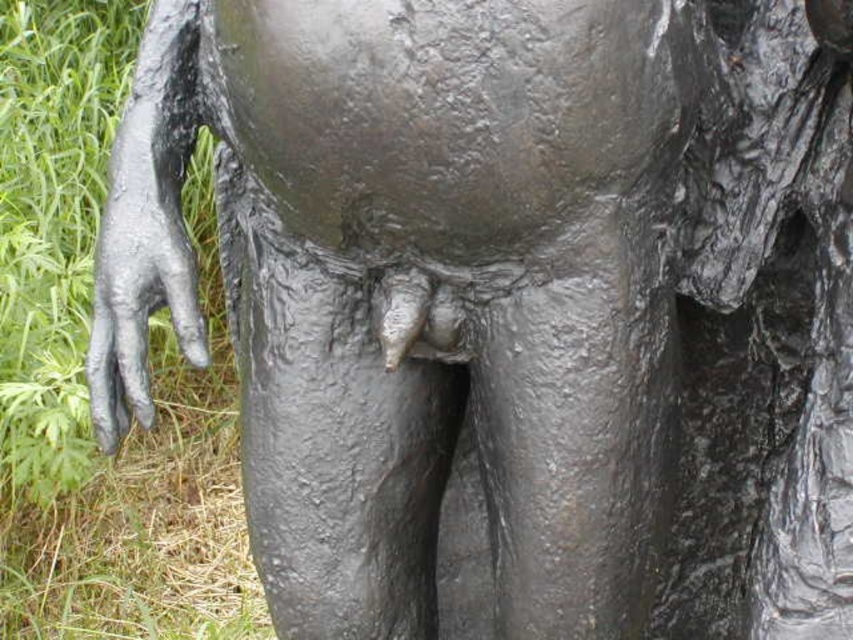
Question: Can you confirm if green grass at left is positioned below shiny black hand at left?

Choices:
 (A) no
 (B) yes

Answer: (A)

Question: Which object is farther from the camera taking this photo?

Choices:
 (A) green grass at left
 (B) shiny black hand at left

Answer: (A)

Question: Does green grass at left lie in front of shiny black hand at left?

Choices:
 (A) yes
 (B) no

Answer: (B)

Question: Can you confirm if green grass at left is wider than shiny black hand at left?

Choices:
 (A) yes
 (B) no

Answer: (A)